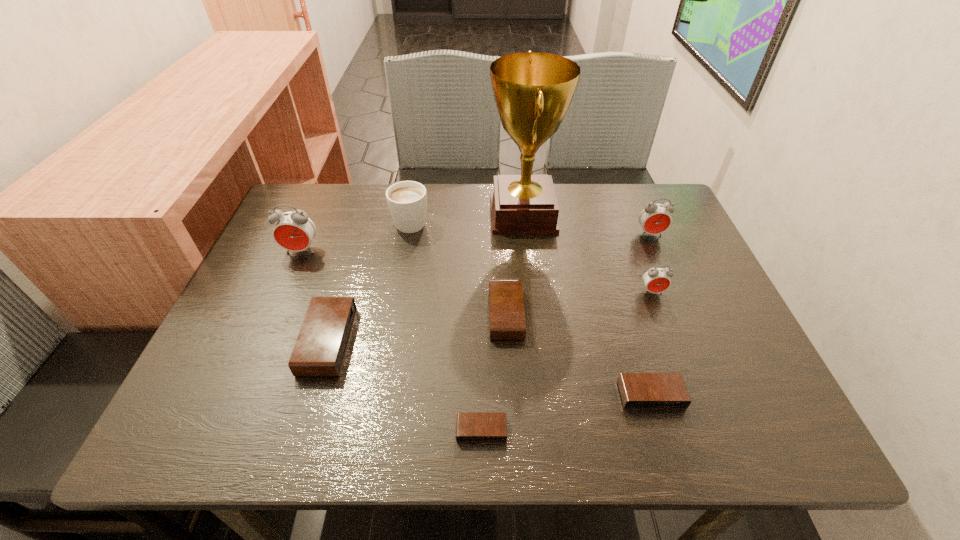
The image size is (960, 540). I want to click on the second alarm clock from left to right, so click(320, 348).

This screenshot has height=540, width=960. Find the location of `the leftmost black alarm clock`. the leftmost black alarm clock is located at coordinates (320, 348).

The image size is (960, 540). Find the location of `the third shortest alarm clock`. the third shortest alarm clock is located at coordinates (506, 306).

Identify the location of the seventh tallest object. The height and width of the screenshot is (540, 960). (506, 306).

Find the location of a particular element. the second shortest object is located at coordinates (638, 390).

The width and height of the screenshot is (960, 540). In order to click on the rightmost black alarm clock in this screenshot , I will do `click(638, 390)`.

At what (x,y) coordinates should I click in order to perform the action: click on the shortest alarm clock. Please return your answer as a coordinate pair (x, y). Looking at the image, I should click on (470, 426).

Image resolution: width=960 pixels, height=540 pixels. Find the location of `the nearest black alarm clock`. the nearest black alarm clock is located at coordinates (470, 426).

Where is `vacant space located 0.280m on the plaque of the tallest object`? Image resolution: width=960 pixels, height=540 pixels. vacant space located 0.280m on the plaque of the tallest object is located at coordinates (390, 213).

I want to click on free region located on the plaque of the tallest object, so [400, 213].